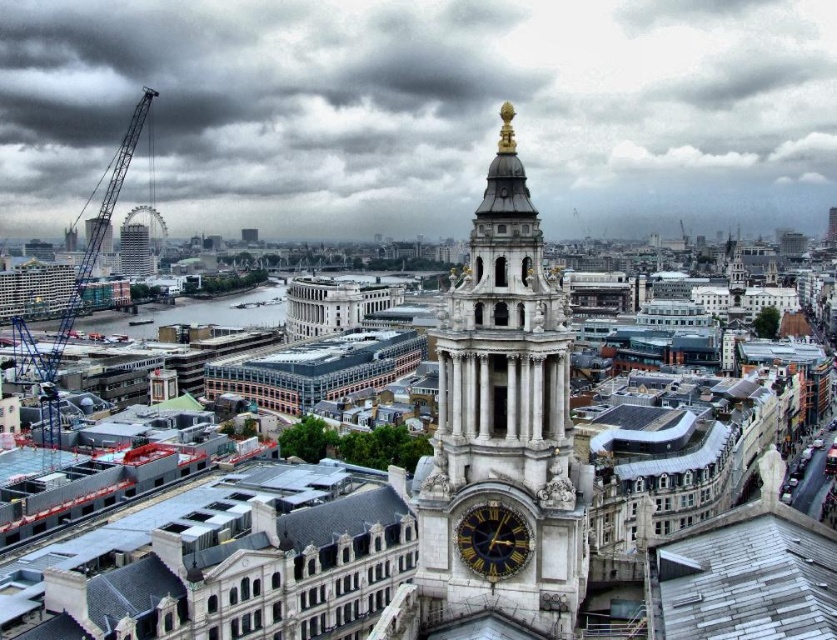
You are a construction worker who needs to operate a crane that is 140 meters away from the camera. You are currently standing at the camera position. Can you safely operate the blue metallic crane at left from your current position?

The blue metallic crane at left is 142.05 meters away from the camera, which is slightly further than the 140 meters required. Therefore, you may not be able to safely operate it from your current position.

You are a tourist standing in the city and want to take a photo of the blue metallic crane at left and the matte gray skyscraper at left. Which object will appear larger in your photo?

The blue metallic crane at left will appear larger in your photo because it is closer to you than the matte gray skyscraper at left.